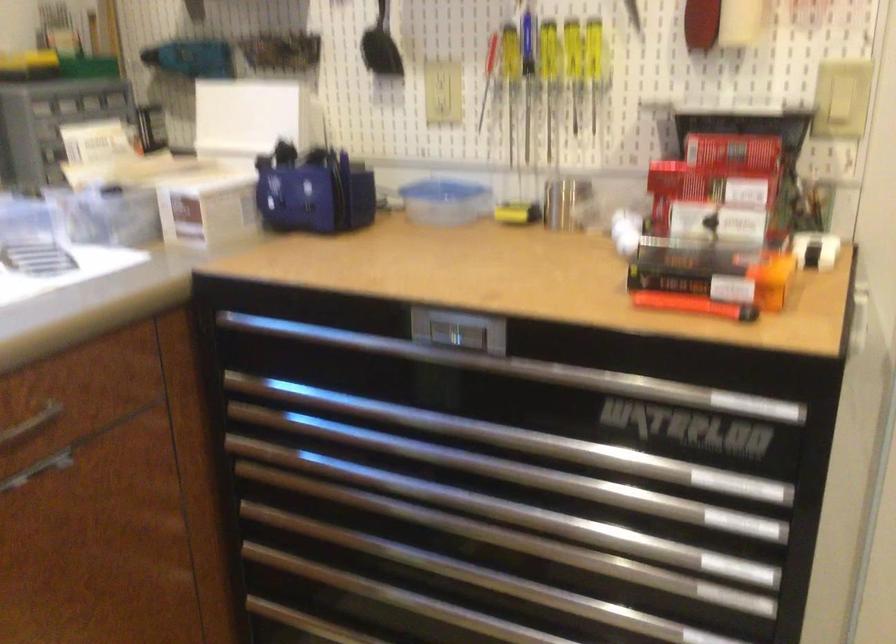
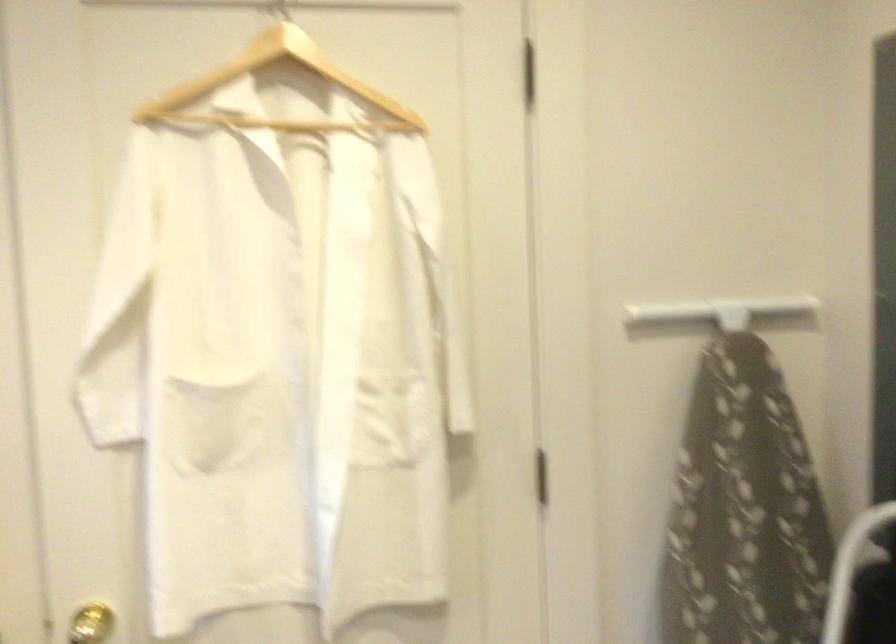
Question: Based on the continuous images, in which direction is the camera rotating? Reply with the corresponding letter.

Choices:
 (A) Left
 (B) Right
 (C) Up
 (D) Down

Answer: (B)